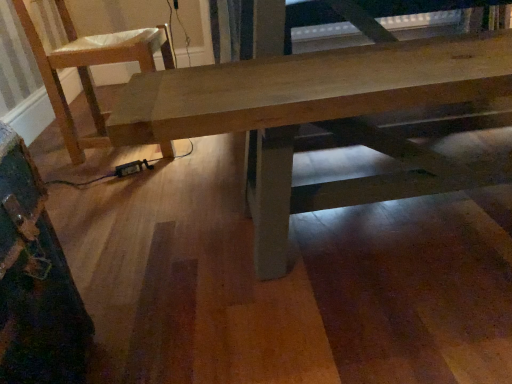
The height and width of the screenshot is (384, 512). In order to click on vacant region below light brown wood chair at upper left (from a real-world perspective) in this screenshot , I will do `click(111, 154)`.